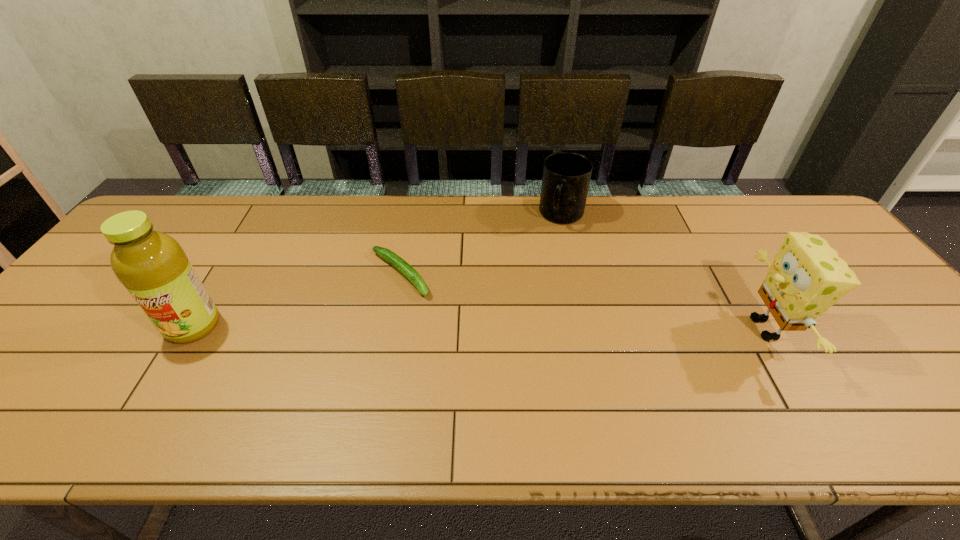
You are a GUI agent. You are given a task and a screenshot of the screen. Output one action in this format:
    pyautogui.click(x=<x>, y=<y>)
    Task: Click on the vacant region at the far edge of the desktop
    The width and height of the screenshot is (960, 540).
    Given the screenshot: What is the action you would take?
    pyautogui.click(x=284, y=212)

Where is `vacant region at the near edge`? The image size is (960, 540). vacant region at the near edge is located at coordinates (869, 386).

The width and height of the screenshot is (960, 540). In the image, there is a desktop. In order to click on free space at the far left corner in this screenshot , I will do `click(168, 205)`.

Find the location of a particular element. The height and width of the screenshot is (540, 960). vacant position at the far right corner of the desktop is located at coordinates (805, 229).

Locate an element on the screen. Image resolution: width=960 pixels, height=540 pixels. free space at the near right corner of the desktop is located at coordinates (942, 394).

At what (x,y) coordinates should I click in order to perform the action: click on vacant area between the second shortest object and the sponge. Please return your answer as a coordinate pair (x, y). Image resolution: width=960 pixels, height=540 pixels. Looking at the image, I should click on (663, 272).

Locate an element on the screen. free space between the farthest object and the tallest object is located at coordinates (377, 271).

Where is `vacant area that lies between the fruit juice and the third object from right to left`? The height and width of the screenshot is (540, 960). vacant area that lies between the fruit juice and the third object from right to left is located at coordinates (297, 300).

You are a GUI agent. You are given a task and a screenshot of the screen. Output one action in this format:
    pyautogui.click(x=<x>, y=<y>)
    Task: Click on the vacant space that is in between the farthest object and the zucchini
    The image size is (960, 540).
    Given the screenshot: What is the action you would take?
    pyautogui.click(x=481, y=245)

The image size is (960, 540). Identify the location of free point between the third object from right to left and the third tallest object. (481, 245).